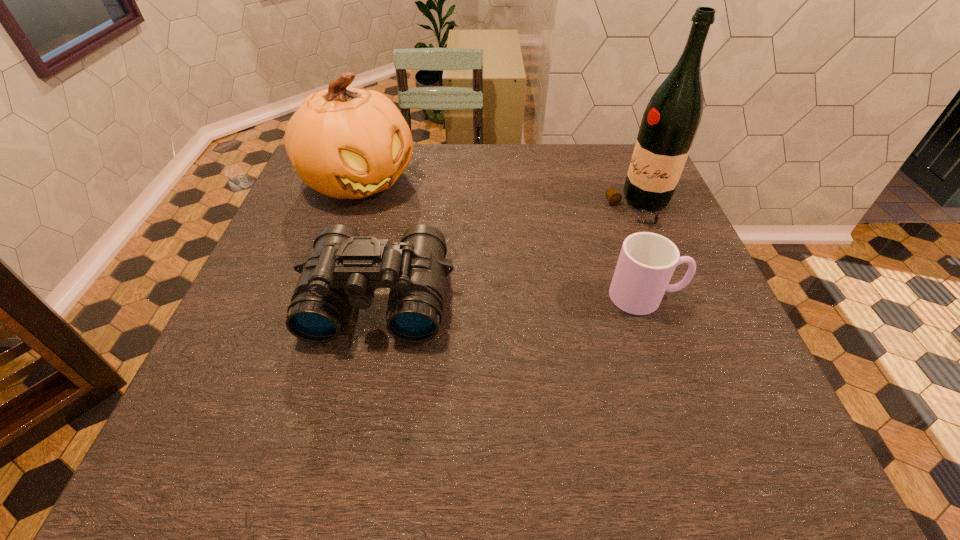
The width and height of the screenshot is (960, 540). I want to click on vacant space on the desktop that is between the binoculars and the cup and is positioned on the front face of the third shortest object, so pyautogui.click(x=496, y=297).

Where is `free spot on the desktop that is between the binoculars and the shortest object and is positioned on the surface of the wine bottle`? The height and width of the screenshot is (540, 960). free spot on the desktop that is between the binoculars and the shortest object and is positioned on the surface of the wine bottle is located at coordinates (490, 297).